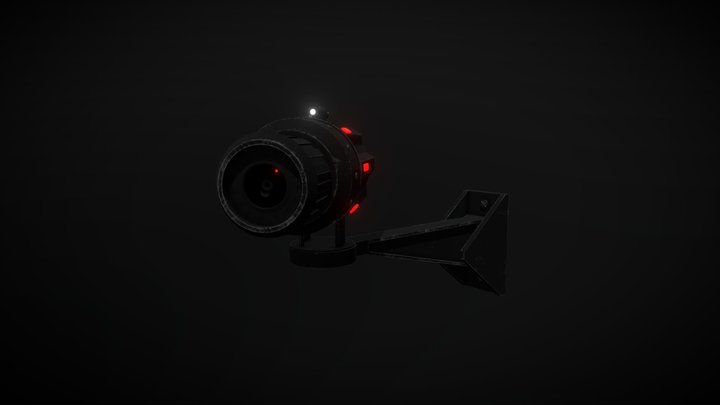
Identify the location of photo of a security camera. (456, 139).